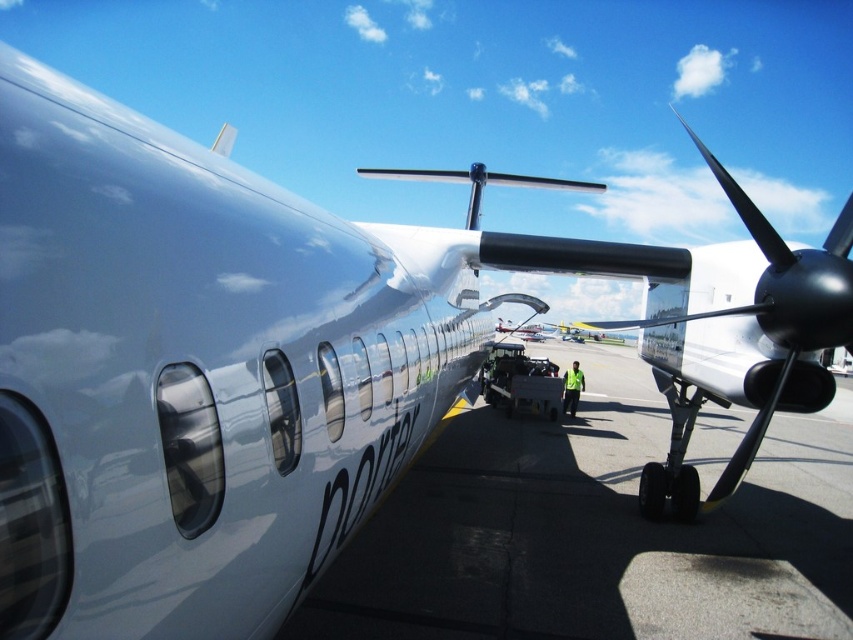
Which is in front, point (570, 618) or point (664, 378)?

Point (570, 618) is more forward.

Between smooth concrete tarmac at center and shiny black propeller at right, which one has more height?

Standing taller between the two is shiny black propeller at right.

Does point (537, 451) come farther from viewer compared to point (822, 381)?

Yes, it is behind point (822, 381).

What are the coordinates of `smooth concrete tarmac at center` in the screenshot? It's located at (595, 532).